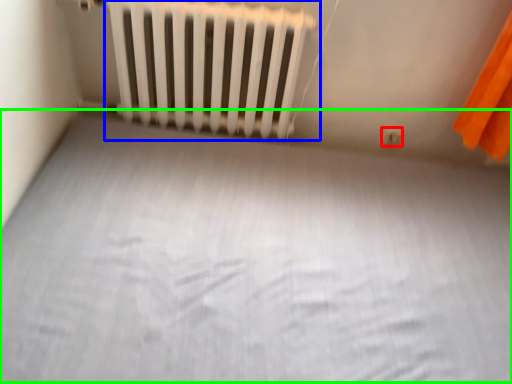
Question: Considering the real-world distances, which object is closest to electric outlet (highlighted by a red box)? radiator (highlighted by a blue box) or bed frame (highlighted by a green box).

Choices:
 (A) radiator
 (B) bed frame

Answer: (A)